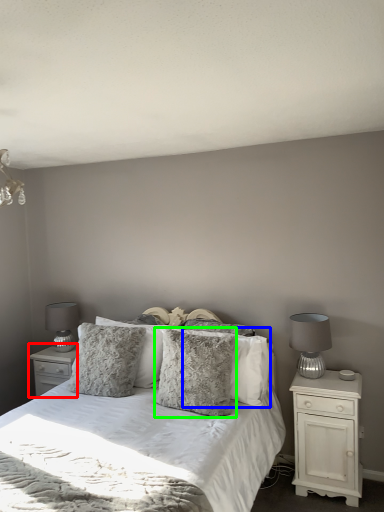
Question: Which is farther away from nightstand (highlighted by a red box)? pillow (highlighted by a blue box) or pillow (highlighted by a green box)?

Choices:
 (A) pillow
 (B) pillow

Answer: (A)